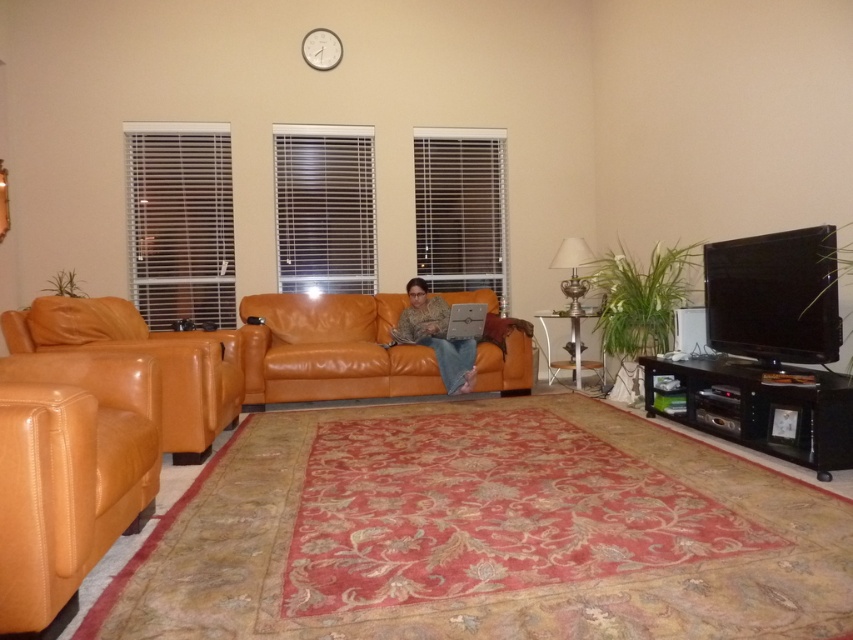
Question: Is orange leather couch at center wider than matte leather chair at left?

Choices:
 (A) no
 (B) yes

Answer: (B)

Question: Can you confirm if orange leather couch at center is positioned below matte leather chair at left?

Choices:
 (A) no
 (B) yes

Answer: (B)

Question: Does saddle brown leather armchair at left have a lesser width compared to matte leather chair at left?

Choices:
 (A) no
 (B) yes

Answer: (B)

Question: Which point is closer to the camera taking this photo?

Choices:
 (A) (341, 310)
 (B) (186, 451)
 (C) (128, 452)
 (D) (439, 307)

Answer: (C)

Question: Considering the real-world distances, which object is closest to the orange leather couch at center?

Choices:
 (A) camouflage fabric shirt at center
 (B) saddle brown leather armchair at left
 (C) matte leather chair at left

Answer: (A)

Question: Estimate the real-world distances between objects in this image. Which object is closer to the orange leather couch at center?

Choices:
 (A) saddle brown leather armchair at left
 (B) camouflage fabric shirt at center
 (C) matte leather chair at left

Answer: (B)